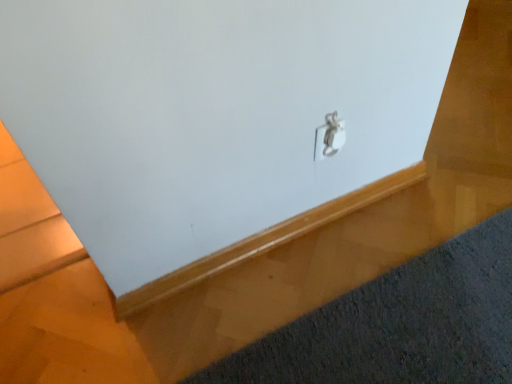
Question: Would you say silver metallic lock at center is to the left or to the right of dark gray carpet at lower right in the picture?

Choices:
 (A) left
 (B) right

Answer: (A)

Question: Is silver metallic lock at center inside the boundaries of dark gray carpet at lower right, or outside?

Choices:
 (A) inside
 (B) outside

Answer: (B)

Question: In terms of width, does silver metallic lock at center look wider or thinner when compared to dark gray carpet at lower right?

Choices:
 (A) thin
 (B) wide

Answer: (A)

Question: Would you say dark gray carpet at lower right is inside or outside silver metallic lock at center?

Choices:
 (A) outside
 (B) inside

Answer: (A)

Question: From a real-world perspective, is dark gray carpet at lower right physically located above or below silver metallic lock at center?

Choices:
 (A) below
 (B) above

Answer: (A)

Question: Considering the relative positions of dark gray carpet at lower right and silver metallic lock at center in the image provided, is dark gray carpet at lower right to the left or to the right of silver metallic lock at center?

Choices:
 (A) right
 (B) left

Answer: (A)

Question: In terms of size, does dark gray carpet at lower right appear bigger or smaller than silver metallic lock at center?

Choices:
 (A) big
 (B) small

Answer: (A)